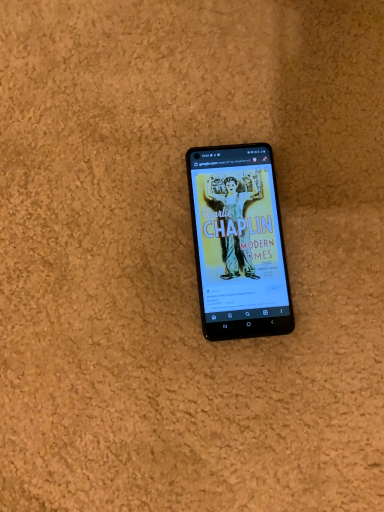
This screenshot has height=512, width=384. What do you see at coordinates (238, 242) in the screenshot?
I see `black glossy mobile phone at center` at bounding box center [238, 242].

I want to click on black glossy mobile phone at center, so click(x=238, y=242).

What is the approximate width of black glossy mobile phone at center?

It is 3.09 inches.

Measure the distance between point (x=203, y=253) and camera.

The distance of point (x=203, y=253) from camera is 13.74 inches.

This screenshot has height=512, width=384. I want to click on black glossy mobile phone at center, so click(x=238, y=242).